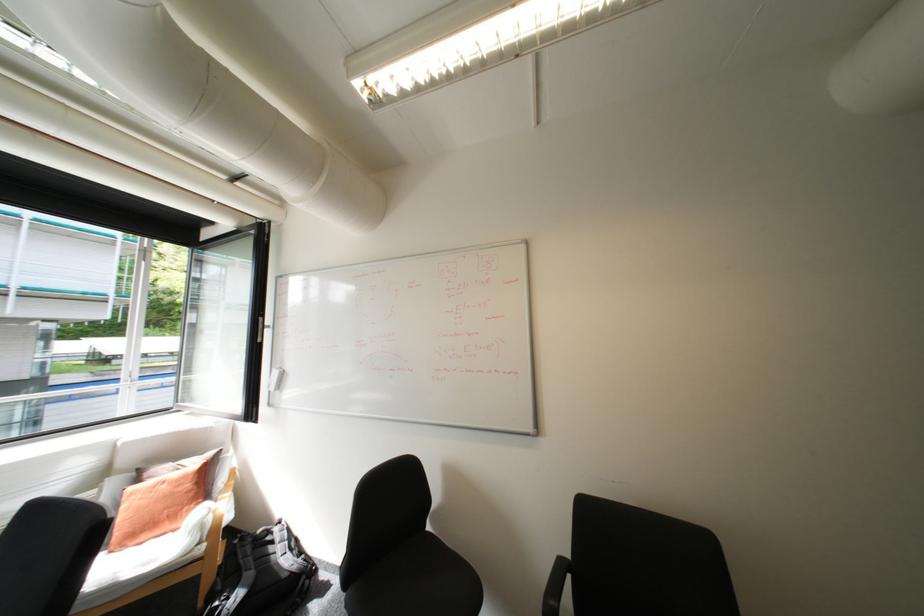
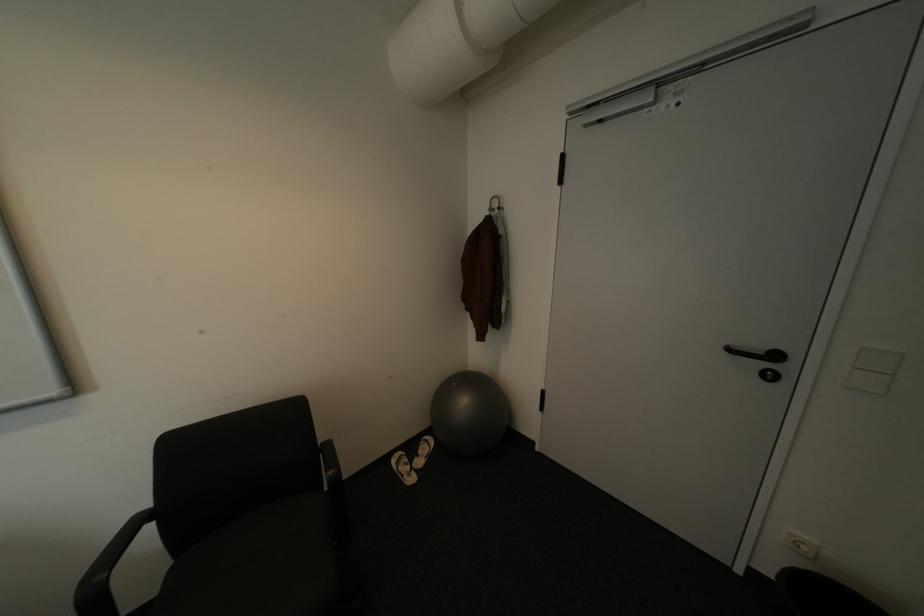
Where in the second image is the point corresponding to point (566, 554) from the first image?

(142, 515)